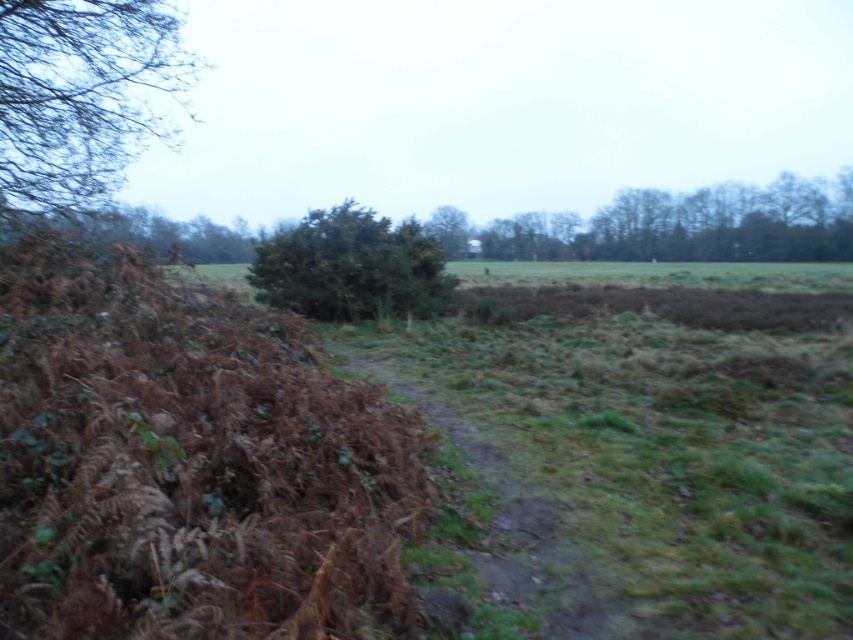
Is point (508, 225) farther from camera compared to point (337, 227)?

Yes, it is behind point (337, 227).

Between green leafy tree at upper center and green leafy tree at center, which one has less height?

With less height is green leafy tree at upper center.

Who is more distant from viewer, (488, 252) or (282, 260)?

The point (488, 252) is more distant.

Where is `green leafy tree at upper center`? This screenshot has width=853, height=640. green leafy tree at upper center is located at coordinates (677, 225).

Is brown textured bush at upper left taller than green leafy tree at upper center?

Yes.

Can you confirm if brown textured bush at upper left is positioned below green leafy tree at upper center?

Yes, brown textured bush at upper left is below green leafy tree at upper center.

Who is more distant from viewer, (79, 157) or (608, 253)?

Positioned behind is point (608, 253).

In order to click on brown textured bush at upper left in this screenshot , I will do `click(82, 96)`.

Which is above, green grassy trail at center or green leafy tree at center?

green leafy tree at center is higher up.

In the scene shown: Which is more to the right, green grassy trail at center or green leafy tree at center?

Positioned to the right is green grassy trail at center.

Which is in front, point (512, 480) or point (252, 262)?

Point (512, 480) is in front.

Identify the location of green grassy trail at center. The width and height of the screenshot is (853, 640). (514, 525).